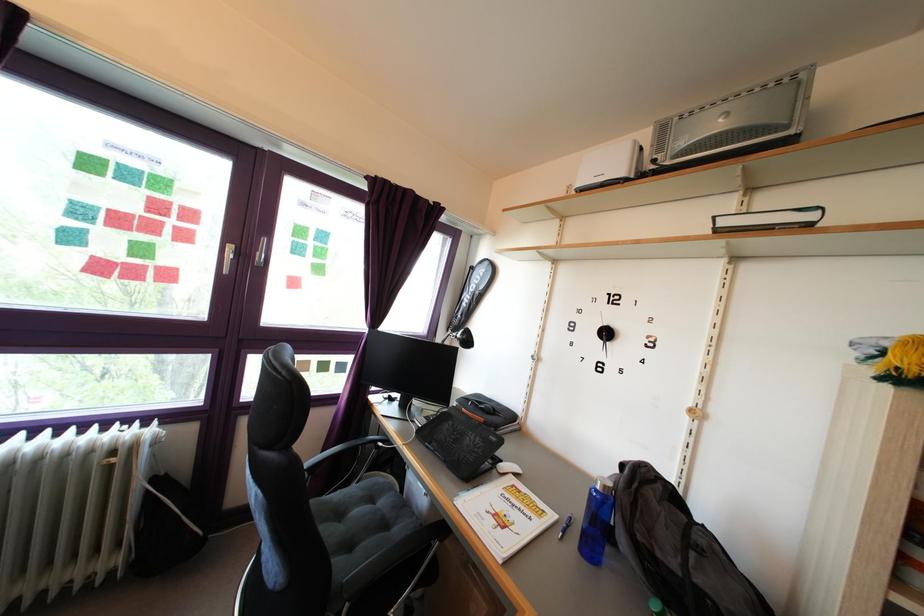
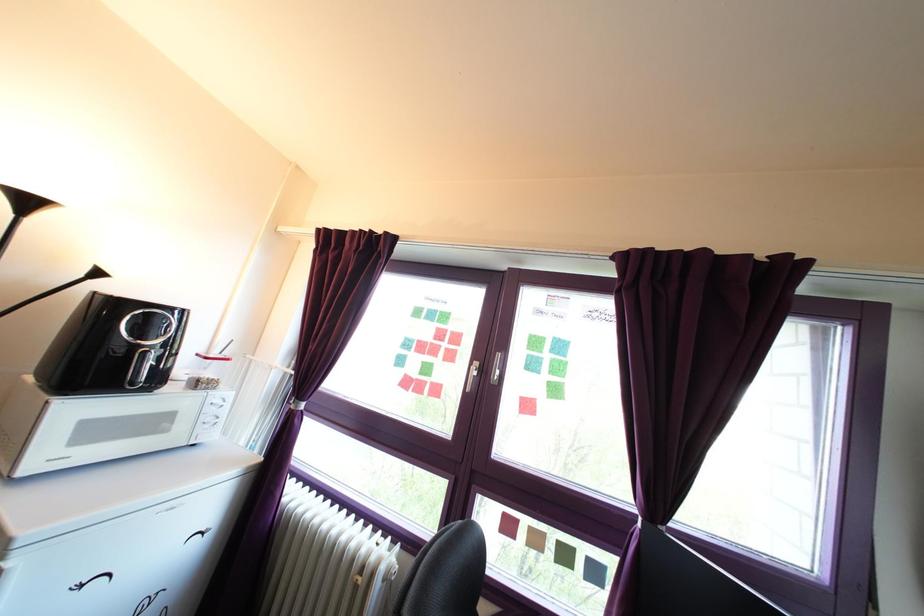
Looking at this image, how did the camera likely rotate?

The rotation direction of the camera is left-up.